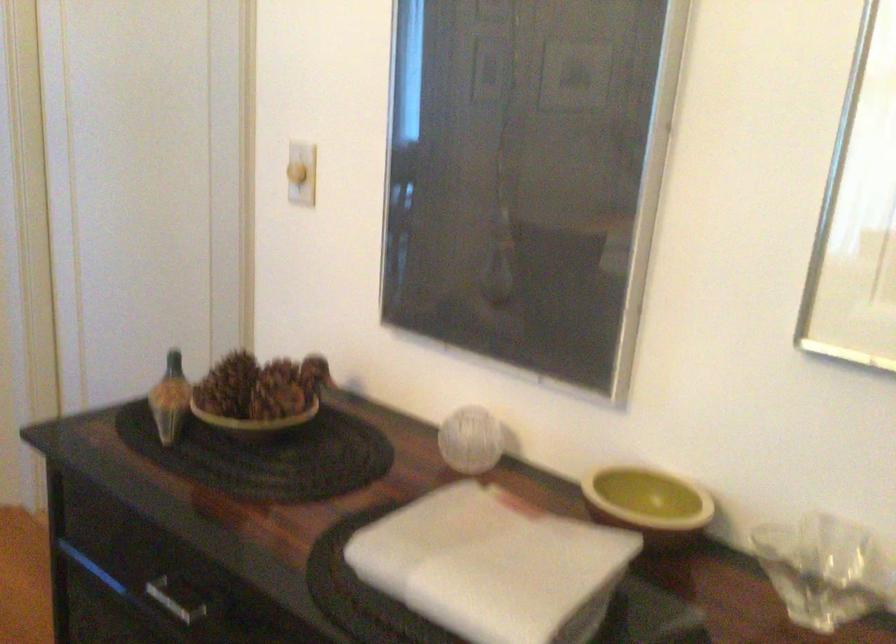
Find the location of a particular element. Image resolution: width=896 pixels, height=644 pixels. spherical glass object is located at coordinates (470, 440).